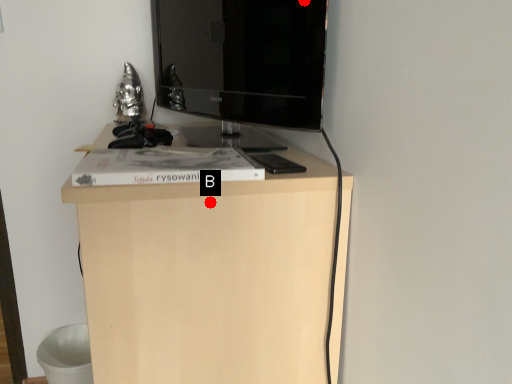
Question: Two points are circled on the image, labeled by A and B beside each circle. Which point appears closest to the camera in this image?

Choices:
 (A) A is closer
 (B) B is closer

Answer: (B)